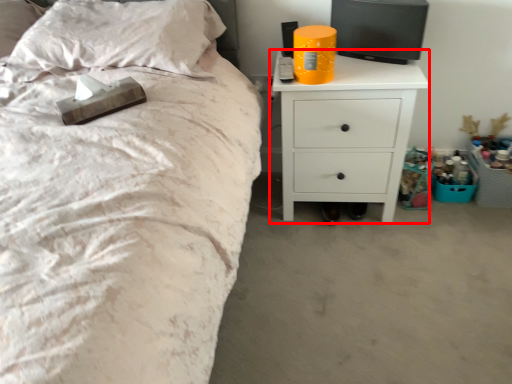
Question: Considering the relative positions of nightstand (annotated by the red box) and pillow in the image provided, where is nightstand (annotated by the red box) located with respect to the staircase?

Choices:
 (A) left
 (B) right

Answer: (B)